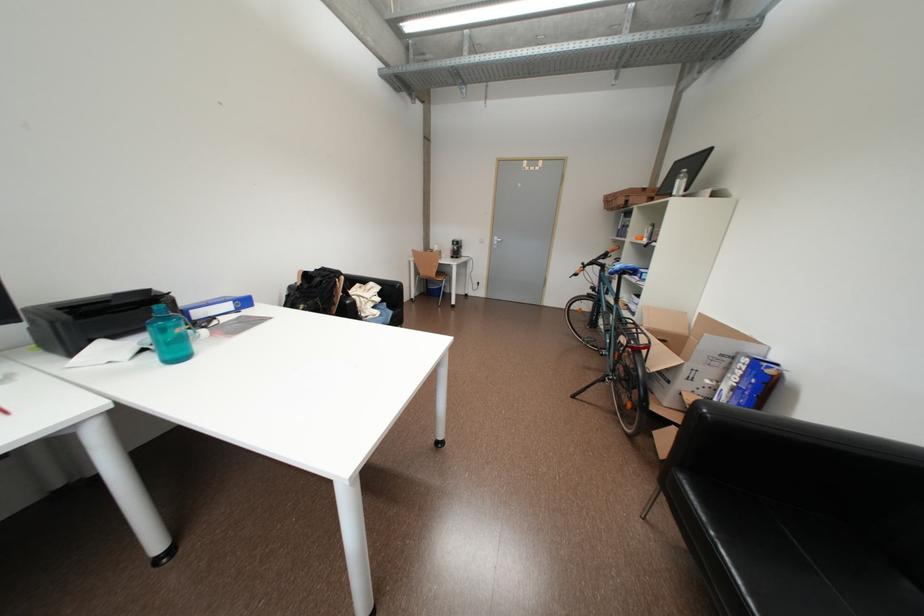
The width and height of the screenshot is (924, 616). I want to click on sofa sitting surface, so click(848, 564).